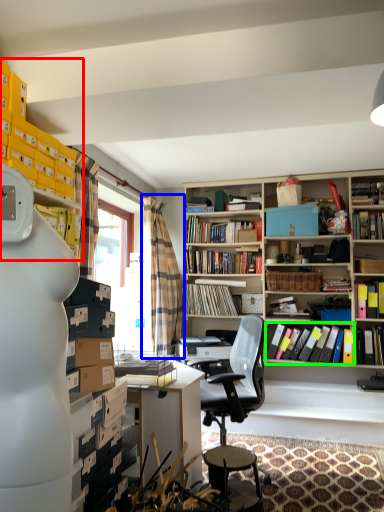
Question: Estimate the real-world distances between objects in this image. Which object is closer to shelf (highlighted by a red box), curtain (highlighted by a blue box) or book (highlighted by a green box)?

Choices:
 (A) curtain
 (B) book

Answer: (A)